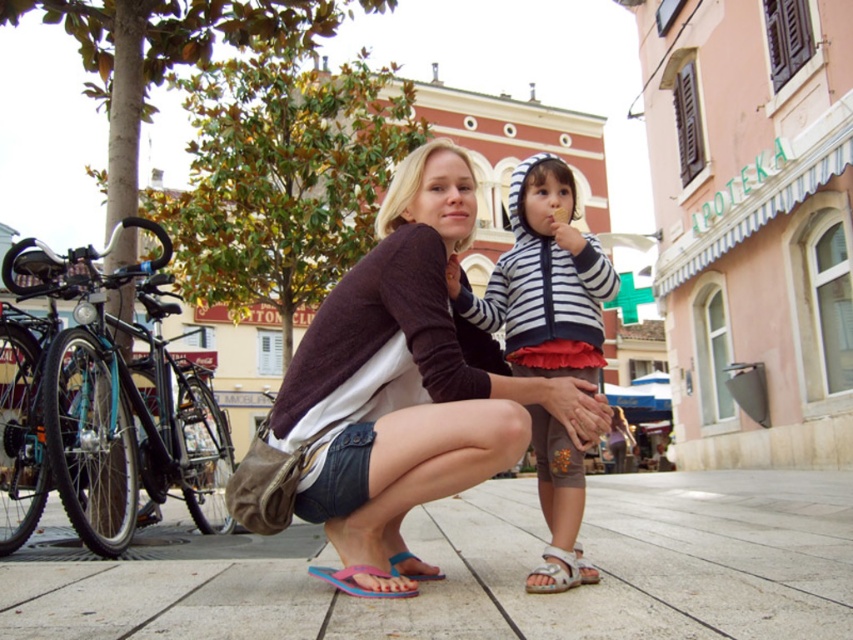
Question: Can you confirm if smooth concrete pavement at center is thinner than dark purple sweater at center?

Choices:
 (A) yes
 (B) no

Answer: (B)

Question: Among these objects, which one is farthest from the camera?

Choices:
 (A) pink rubber flip-flop at lower center
 (B) blue rubber sandal at lower center
 (C) striped cotton hoodie at center

Answer: (C)

Question: Based on their relative distances, which object is nearer to the pink rubber flip-flop at lower center?

Choices:
 (A) dark purple sweater at center
 (B) striped cotton hoodie at center
 (C) smooth concrete pavement at center

Answer: (A)

Question: Can you confirm if dark purple sweater at center is smaller than beige fabric sandal at lower center?

Choices:
 (A) yes
 (B) no

Answer: (B)

Question: Estimate the real-world distances between objects in this image. Which object is closer to the striped cotton hoodie at center?

Choices:
 (A) pink rubber flip-flop at lower center
 (B) beige fabric sandal at lower center
 (C) dark purple sweater at center
 (D) blue rubber sandal at lower center

Answer: (B)

Question: Is dark purple sweater at center further to the viewer compared to pink rubber flip-flop at lower center?

Choices:
 (A) no
 (B) yes

Answer: (A)